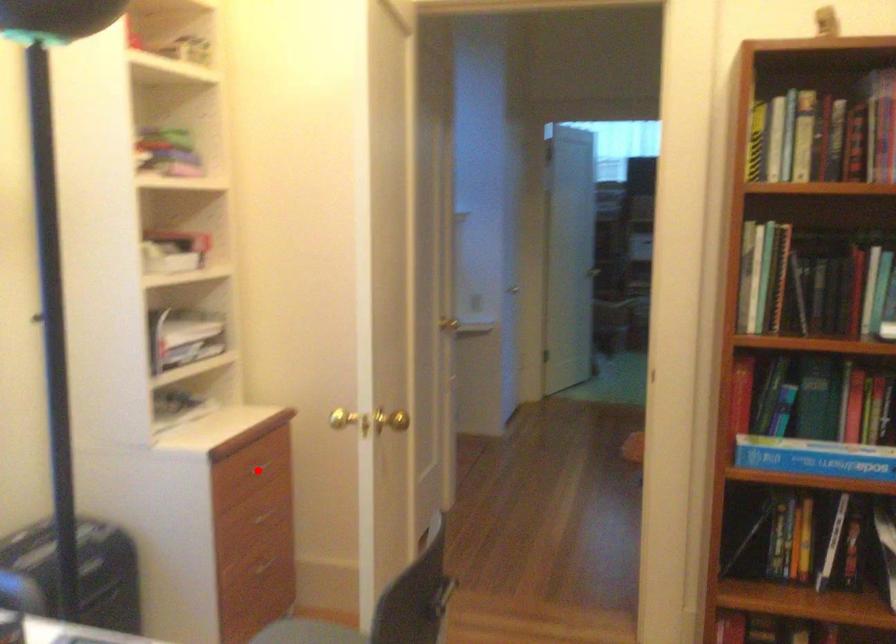
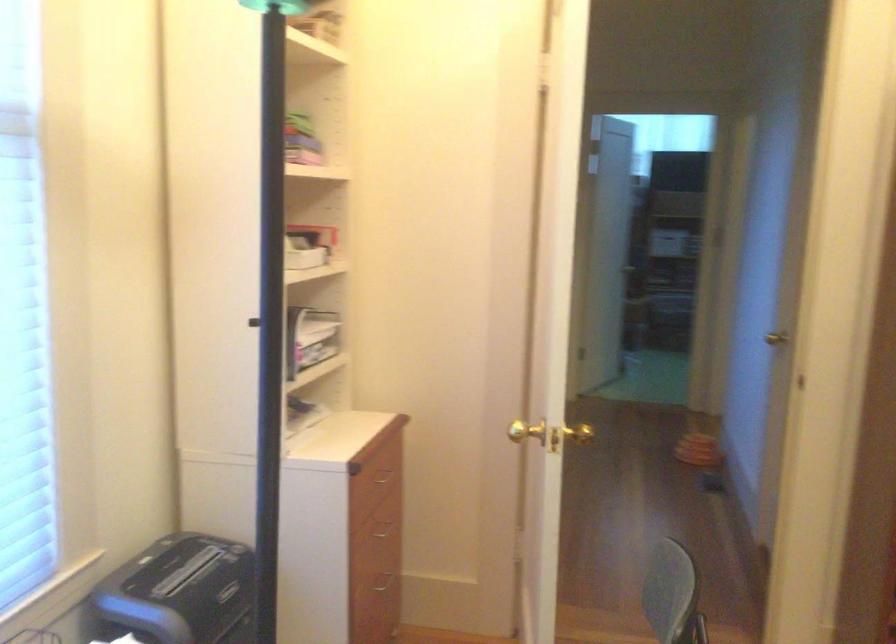
Question: I am providing you with two images of the same scene from different viewpoints. A red point is marked on the first image. Is the red point's position out of view in image 2?

Choices:
 (A) Yes
 (B) No

Answer: (B)